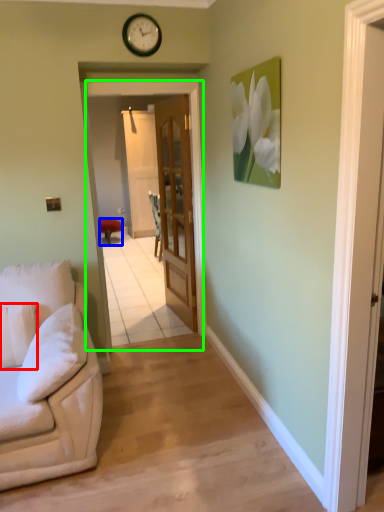
Question: Estimate the real-world distances between objects in this image. Which object is closer to pillow (highlighted by a red box), furniture (highlighted by a blue box) or screen door (highlighted by a green box)?

Choices:
 (A) furniture
 (B) screen door

Answer: (B)